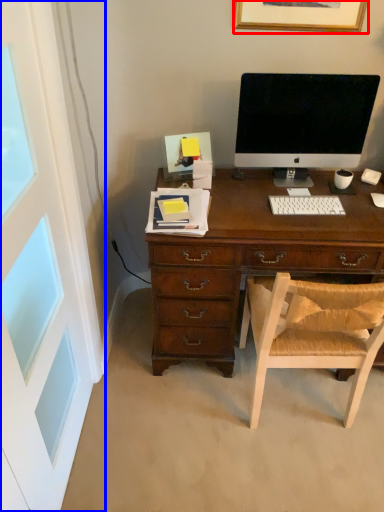
Question: Among these objects, which one is nearest to the camera, picture frame (highlighted by a red box) or screen door (highlighted by a blue box)?

Choices:
 (A) picture frame
 (B) screen door

Answer: (B)